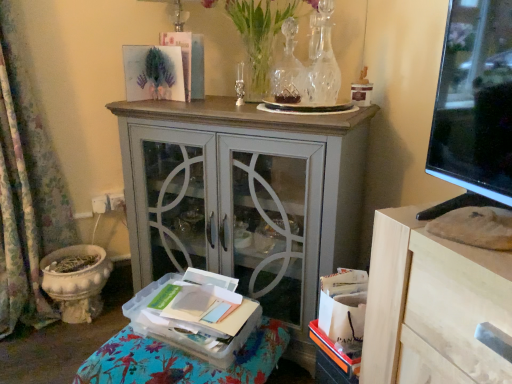
Question: Is point (285, 24) closer or farther from the camera than point (257, 87)?

Choices:
 (A) farther
 (B) closer

Answer: (B)

Question: From their relative heights in the image, would you say clear glass vase at upper center, acting as the 1th vase starting from the left, is taller or shorter than clear glass vase at upper center?

Choices:
 (A) short
 (B) tall

Answer: (A)

Question: Estimate the real-world distances between objects in this image. Which object is closer to the clear glass vase at upper center, acting as the 1th vase starting from the left?

Choices:
 (A) clear glass vase at upper center
 (B) clear glass vase at upper center, the 1th vase positioned from the right
 (C) floral fabric curtain at left
 (D) gray painted cabinet at center
 (E) clear plastic tray at lower left

Answer: (B)

Question: Estimate the real-world distances between objects in this image. Which object is closer to the clear glass vase at upper center, acting as the 1th vase starting from the left?

Choices:
 (A) clear plastic tray at lower left
 (B) floral fabric curtain at left
 (C) clear glass vase at upper center, the 1th vase positioned from the right
 (D) gray painted cabinet at center
 (E) clear glass vase at upper center

Answer: (C)